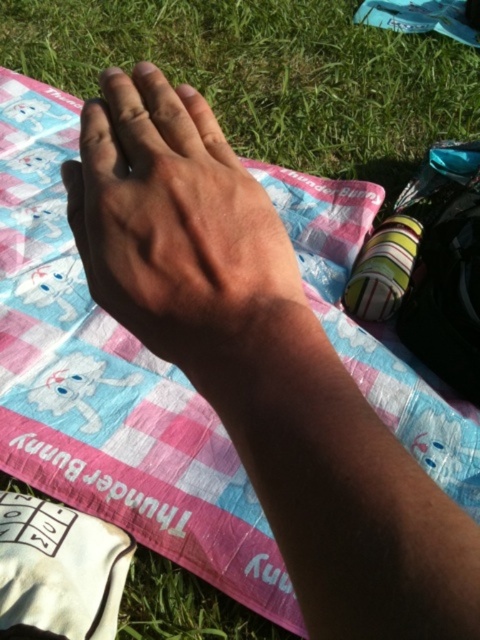
You are planning to place a small toy rabbit on the picnic blanket. Based on the scene, which object is bigger, the green grass at upper center or the dry skin hand at center?

The green grass at upper center is larger in size compared to the dry skin hand at center, so the toy rabbit would fit better on the green grass at upper center.

You are planning to place a small toy rabbit on the picnic blanket. Given the green grass at upper center and the dry skin hand at center, which area has a wider space to accommodate the toy?

The green grass at upper center has a wider space than the dry skin hand at center, so the toy rabbit should be placed there.

You are a photographer setting up a shot of the picnic scene. You need to ensure that the green grass at upper center does not block the dry skin hand at center in the final image. Based on their sizes, which object should you focus on to keep it visible?

The green grass at upper center is taller than the dry skin hand at center, so focusing on the dry skin hand at center will ensure it remains visible as the grass might obscure it if not properly framed.